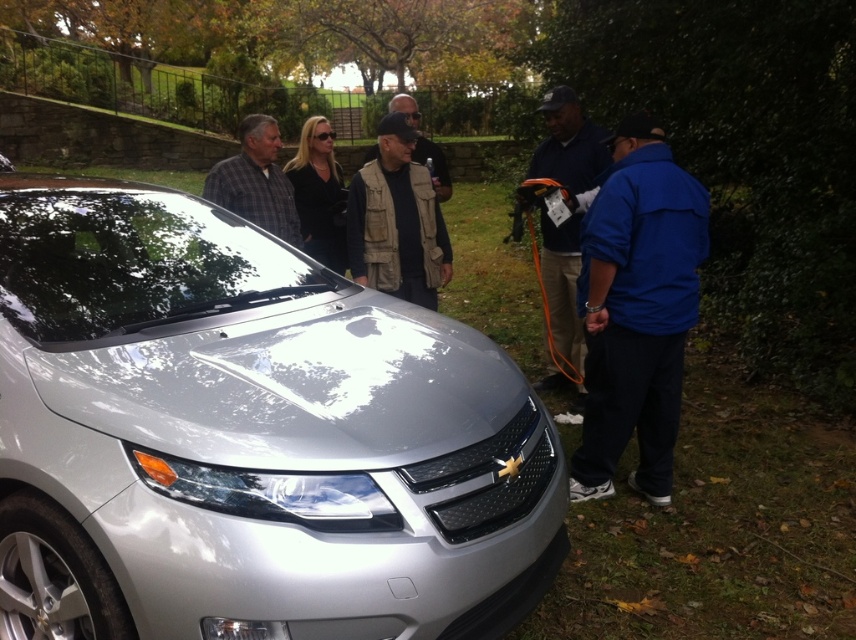
Find the location of a particular element. This screenshot has width=856, height=640. sleek silver car at center is located at coordinates (248, 436).

Does sleek silver car at center have a smaller size compared to blue fabric jacket at right?

No.

At what (x,y) coordinates should I click in order to perform the action: click on sleek silver car at center. Please return your answer as a coordinate pair (x, y). The width and height of the screenshot is (856, 640). Looking at the image, I should click on (248, 436).

Can you confirm if sleek silver car at center is positioned below dark blue fabric jacket at right?

Yes, sleek silver car at center is below dark blue fabric jacket at right.

Does sleek silver car at center have a greater height compared to dark blue fabric jacket at right?

No.

Is point (399, 435) positioned in front of point (557, 97)?

That is True.

Where is `sleek silver car at center`? sleek silver car at center is located at coordinates (248, 436).

Can you confirm if sleek silver car at center is positioned below plaid fabric shirt at center?

Yes, sleek silver car at center is below plaid fabric shirt at center.

Does sleek silver car at center have a greater width compared to plaid fabric shirt at center?

No, sleek silver car at center is not wider than plaid fabric shirt at center.

This screenshot has height=640, width=856. Find the location of `sleek silver car at center`. sleek silver car at center is located at coordinates coord(248,436).